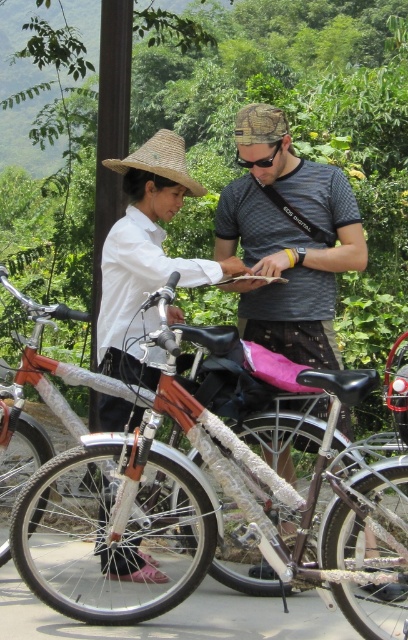
Question: Among these objects, which one is nearest to the camera?

Choices:
 (A) shiny metallic bicycle at center
 (B) matte straw hat at center
 (C) dark gray textured shirt at center

Answer: (A)

Question: Among these objects, which one is farthest from the camera?

Choices:
 (A) shiny metallic bicycle at center
 (B) dark gray textured shirt at center
 (C) matte straw hat at center

Answer: (B)

Question: Can you confirm if shiny metallic bicycle at center is positioned to the left of strawmaterial/texturehat at upper center?

Choices:
 (A) yes
 (B) no

Answer: (B)

Question: Is matte straw hat at center further to camera compared to strawmaterial/texturehat at upper center?

Choices:
 (A) no
 (B) yes

Answer: (A)

Question: Which object is closer to the camera taking this photo?

Choices:
 (A) dark gray textured shirt at center
 (B) matte straw hat at center

Answer: (B)

Question: Is dark gray textured shirt at center closer to camera compared to matte straw hat at center?

Choices:
 (A) no
 (B) yes

Answer: (A)